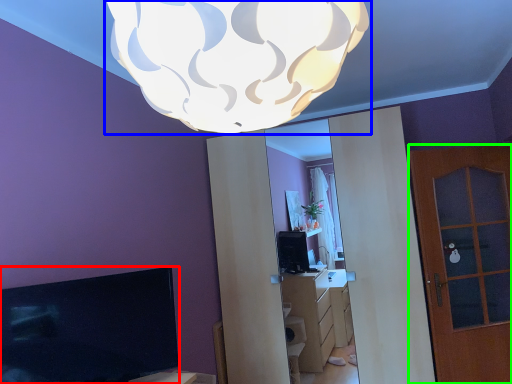
Question: Which object is positioned farthest from television (highlighted by a red box)? Select from lamp (highlighted by a blue box) and door (highlighted by a green box).

Choices:
 (A) lamp
 (B) door

Answer: (B)